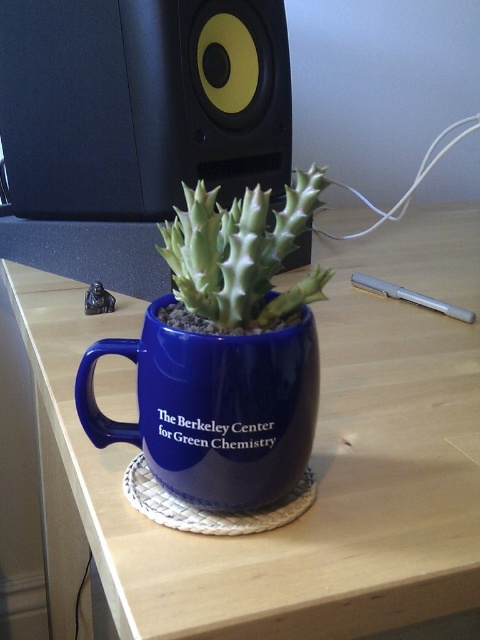
Is wooden table at center wider than green spiky succulent at center?

Indeed, wooden table at center has a greater width compared to green spiky succulent at center.

Does point (186, 552) lie behind point (261, 291)?

No, it is in front of (261, 291).

Is point (439, 481) farther from camera compared to point (197, 202)?

Yes, point (439, 481) is farther from viewer.

The width and height of the screenshot is (480, 640). Identify the location of wooden table at center. (311, 460).

Does black matte speaker at upper left appear on the left side of green spiky succulent at center?

Yes, black matte speaker at upper left is to the left of green spiky succulent at center.

Is the position of black matte speaker at upper left more distant than that of green spiky succulent at center?

Yes, it is.

At what (x,y) coordinates should I click in order to perform the action: click on black matte speaker at upper left. Please return your answer as a coordinate pair (x, y). This screenshot has width=480, height=640. Looking at the image, I should click on point(133,106).

Who is lower down, wooden table at center or blue ceramic mug at center?

blue ceramic mug at center is below.

Is point (467, 259) farther from viewer compared to point (215, 461)?

Yes.

Does point (167, 636) come farther from viewer compared to point (292, 412)?

No, it is not.

The image size is (480, 640). Identify the location of wooden table at center. (311, 460).